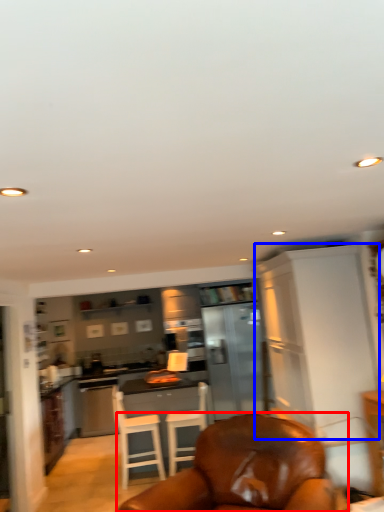
Question: Which object appears farthest to the camera in this image, chair (highlighted by a red box) or cabinetry (highlighted by a blue box)?

Choices:
 (A) chair
 (B) cabinetry

Answer: (B)